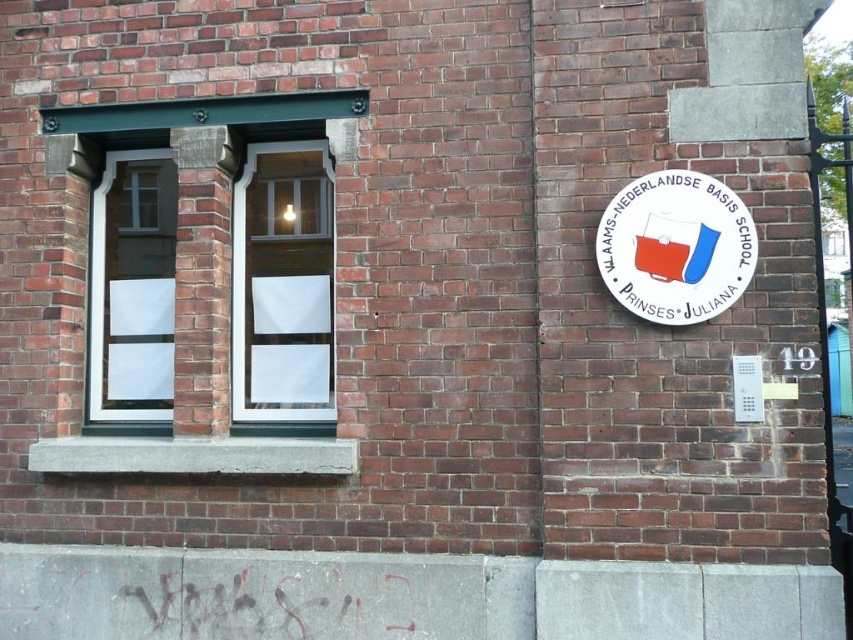
I want to click on white glass window at center, so pyautogui.click(x=283, y=284).

Is white glass window at center bigger than transparent glass door at left?

Yes, white glass window at center is bigger than transparent glass door at left.

Is point (294, 253) less distant than point (123, 154)?

That is True.

I want to click on white glass window at center, so click(x=283, y=284).

Is white plastic sign at upper right below white plastic sign at right?

No, white plastic sign at upper right is not below white plastic sign at right.

Between point (714, 237) and point (737, 410), which one is positioned in front?

Point (737, 410)

What are the coordinates of `white plastic sign at upper right` in the screenshot? It's located at (675, 246).

Where is `white glass window at center`? The height and width of the screenshot is (640, 853). white glass window at center is located at coordinates (283, 284).

Does white glass window at center appear on the left side of white plastic sign at right?

Correct, you'll find white glass window at center to the left of white plastic sign at right.

Identify the location of white glass window at center. The image size is (853, 640). (283, 284).